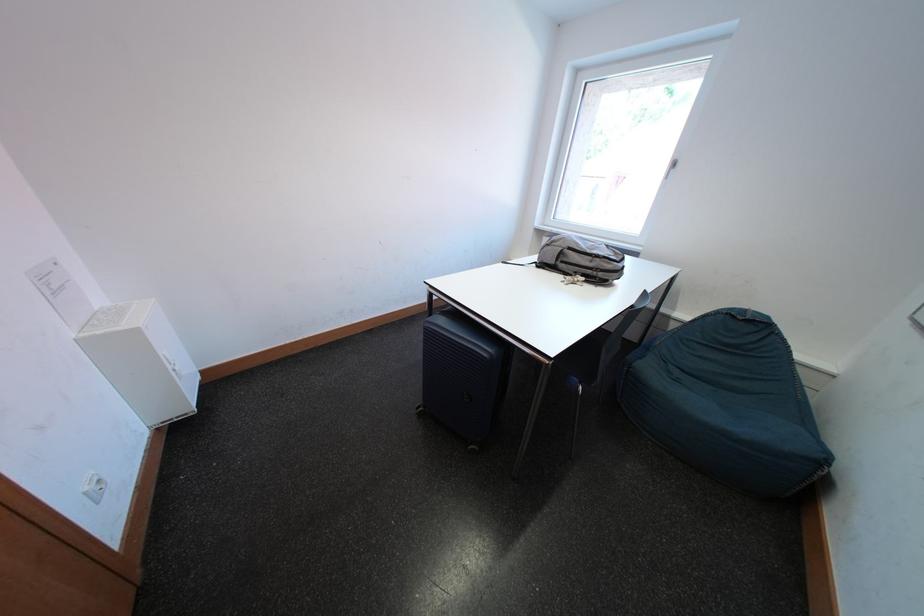
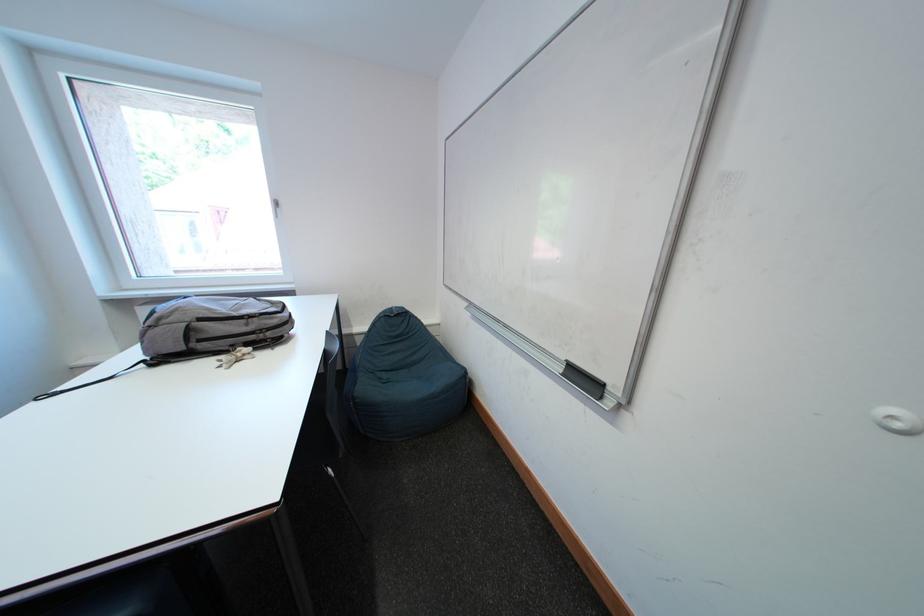
Question: How did the camera likely rotate?

Choices:
 (A) Left
 (B) Right
 (C) Up
 (D) Down

Answer: (B)